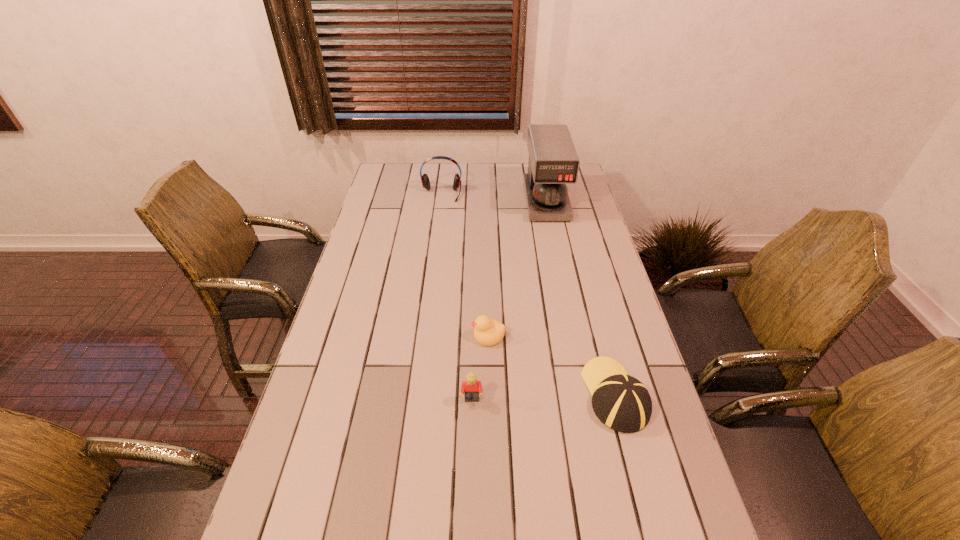
Where is `vacant space located with the brim of the baseball cap facing forward`? vacant space located with the brim of the baseball cap facing forward is located at coordinates (587, 285).

What are the coordinates of `free region located with the brim of the baseball cap facing forward` in the screenshot? It's located at (582, 267).

Image resolution: width=960 pixels, height=540 pixels. I want to click on free spot located 0.070m with the brim of the baseball cap facing forward, so click(601, 341).

What are the coordinates of `free space located on the face of the shortest object` in the screenshot? It's located at click(x=379, y=335).

Where is `vacant space situated on the face of the shortest object`? The width and height of the screenshot is (960, 540). vacant space situated on the face of the shortest object is located at coordinates (444, 335).

This screenshot has width=960, height=540. In order to click on free space located 0.320m on the face of the shortest object in this screenshot , I will do `click(362, 335)`.

Where is `coffee maker present at the far edge`? coffee maker present at the far edge is located at coordinates (553, 162).

The image size is (960, 540). Find the location of `headset positioned at the far edge`. headset positioned at the far edge is located at coordinates (425, 180).

Identify the location of coffee maker present at the right edge. This screenshot has height=540, width=960. (553, 162).

In order to click on baseball cap that is at the right edge in this screenshot , I will do `click(621, 402)`.